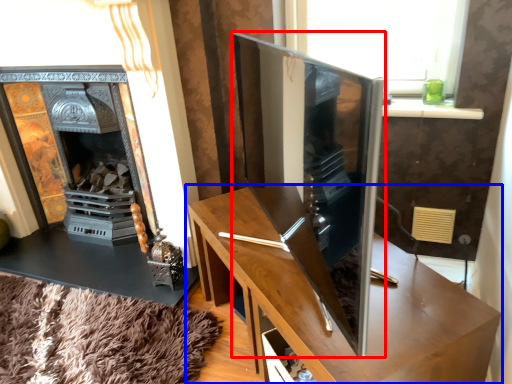
Question: Which point is further to the camera, tv cabinet (highlighted by a red box) or table (highlighted by a blue box)?

Choices:
 (A) tv cabinet
 (B) table

Answer: (B)